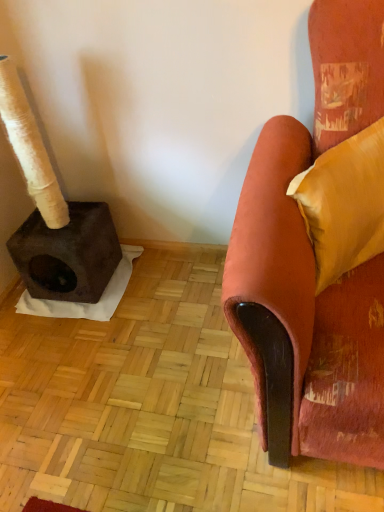
What do you see at coordinates (312, 264) in the screenshot? Image resolution: width=384 pixels, height=512 pixels. I see `velvet orange armchair at right` at bounding box center [312, 264].

I want to click on velvet orange armchair at right, so click(x=312, y=264).

What do you see at coordinates (344, 204) in the screenshot? I see `velvet yellow pillow at right` at bounding box center [344, 204].

Identify the location of velvet yellow pillow at right. This screenshot has width=384, height=512. (344, 204).

Identify the location of velvet orange armchair at right. (312, 264).

Is velvet orange armchair at right to the right of velvet yellow pillow at right from the viewer's perspective?

No, velvet orange armchair at right is not to the right of velvet yellow pillow at right.

Does velvet orange armchair at right lie in front of velvet yellow pillow at right?

Yes, velvet orange armchair at right is in front of velvet yellow pillow at right.

Is point (346, 294) positioned before point (381, 127)?

Yes, it is.

From the image's perspective, which one is positioned higher, velvet orange armchair at right or velvet yellow pillow at right?

From the image's view, velvet yellow pillow at right is above.

From a real-world perspective, is velvet orange armchair at right above or below velvet yellow pillow at right?

velvet orange armchair at right is situated lower than velvet yellow pillow at right in the real world.

Does velvet orange armchair at right have a lesser width compared to velvet yellow pillow at right?

No.

Who is taller, velvet orange armchair at right or velvet yellow pillow at right?

Standing taller between the two is velvet orange armchair at right.

Which of these two, velvet orange armchair at right or velvet yellow pillow at right, is smaller?

velvet yellow pillow at right.

Would you say velvet yellow pillow at right is part of velvet orange armchair at right's contents?

Yes, velvet yellow pillow at right is a part of velvet orange armchair at right.

Is velvet orange armchair at right touching velvet yellow pillow at right?

No, velvet orange armchair at right is not in contact with velvet yellow pillow at right.

Is velvet orange armchair at right positioned with its back to velvet yellow pillow at right?

Yes, velvet orange armchair at right's orientation is away from velvet yellow pillow at right.

In the image, there is a velvet yellow pillow at right. In order to click on chair below it (from the image's perspective) in this screenshot , I will do `click(312, 264)`.

Considering the positions of objects velvet yellow pillow at right and velvet orange armchair at right in the image provided, who is more to the right, velvet yellow pillow at right or velvet orange armchair at right?

Positioned to the right is velvet yellow pillow at right.

Relative to velvet orange armchair at right, is velvet yellow pillow at right in front or behind?

Clearly, velvet yellow pillow at right is behind velvet orange armchair at right.

Considering the positions of point (360, 137) and point (359, 318), is point (360, 137) closer or farther from the camera than point (359, 318)?

Point (360, 137) is farther from the camera than point (359, 318).

From the image's perspective, who appears lower, velvet yellow pillow at right or velvet orange armchair at right?

From the image's view, velvet orange armchair at right is below.

From a real-world perspective, relative to velvet orange armchair at right, is velvet yellow pillow at right vertically above or below?

From a real-world perspective, velvet yellow pillow at right is physically above velvet orange armchair at right.

Is velvet yellow pillow at right wider or thinner than velvet orange armchair at right?

In the image, velvet yellow pillow at right appears to be more narrow than velvet orange armchair at right.

Considering the relative sizes of velvet yellow pillow at right and velvet orange armchair at right in the image provided, is velvet yellow pillow at right taller than velvet orange armchair at right?

No.

Which of these two, velvet yellow pillow at right or velvet orange armchair at right, is bigger?

velvet orange armchair at right.

Is velvet orange armchair at right completely or partially inside velvet yellow pillow at right?

That's incorrect, velvet orange armchair at right is not inside velvet yellow pillow at right.

Is velvet yellow pillow at right in contact with velvet orange armchair at right?

No, velvet yellow pillow at right is not next to velvet orange armchair at right.

Is velvet yellow pillow at right aimed at velvet orange armchair at right?

Yes, velvet yellow pillow at right is aimed at velvet orange armchair at right.

How far apart are velvet yellow pillow at right and velvet orange armchair at right?

A distance of 14.69 centimeters exists between velvet yellow pillow at right and velvet orange armchair at right.

I want to click on chair below the velvet yellow pillow at right (from the image's perspective), so click(x=312, y=264).

Locate an element on the screen. The width and height of the screenshot is (384, 512). pillow lying above the velvet orange armchair at right (from the image's perspective) is located at coordinates (344, 204).

The image size is (384, 512). Find the location of `pillow behind the velvet orange armchair at right`. pillow behind the velvet orange armchair at right is located at coordinates (344, 204).